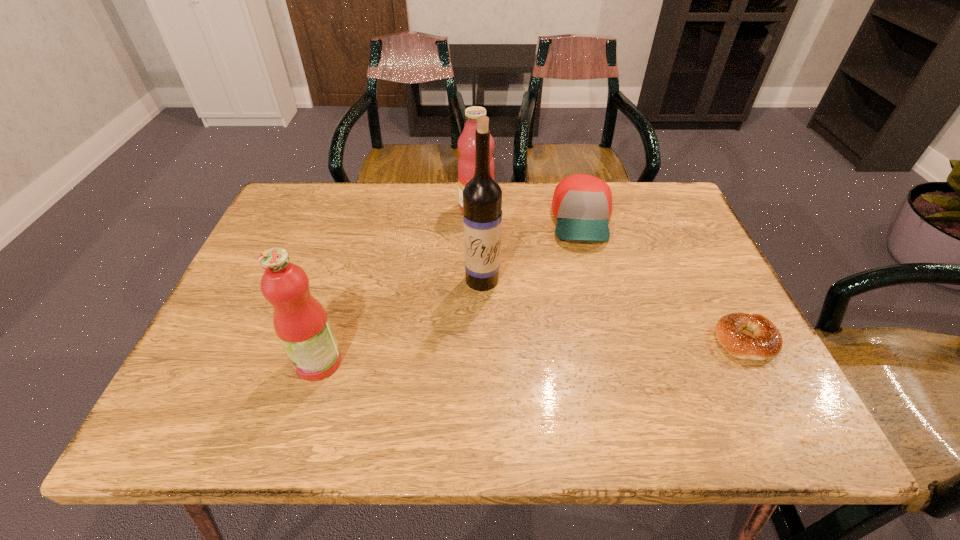
Where is `free space located 0.260m on the label of the third nearest object`? Image resolution: width=960 pixels, height=540 pixels. free space located 0.260m on the label of the third nearest object is located at coordinates (478, 389).

You are a GUI agent. You are given a task and a screenshot of the screen. Output one action in this format:
    pyautogui.click(x=<x>, y=<y>)
    Task: Click on the vacant space located on the label of the third nearest object
    The width and height of the screenshot is (960, 540).
    Given the screenshot: What is the action you would take?
    pyautogui.click(x=479, y=363)

Locate an element on the screen. This screenshot has height=540, width=960. baseball cap at the far edge is located at coordinates (582, 204).

Where is `fruit juice at the far edge`? Image resolution: width=960 pixels, height=540 pixels. fruit juice at the far edge is located at coordinates (466, 145).

What are the coordinates of `fruit juice located at the near edge` in the screenshot? It's located at (300, 321).

This screenshot has width=960, height=540. I want to click on bagel located in the near edge section of the desktop, so tap(766, 342).

At what (x,y) coordinates should I click in order to perform the action: click on object positioned at the right edge. Please return your answer as a coordinate pair (x, y). This screenshot has height=540, width=960. Looking at the image, I should click on (766, 342).

Locate an element on the screen. object situated at the near right corner is located at coordinates (766, 342).

Identify the location of free space at the far edge of the desktop. click(x=392, y=205).

What are the coordinates of `free location at the near edge of the desktop` in the screenshot? It's located at (280, 368).